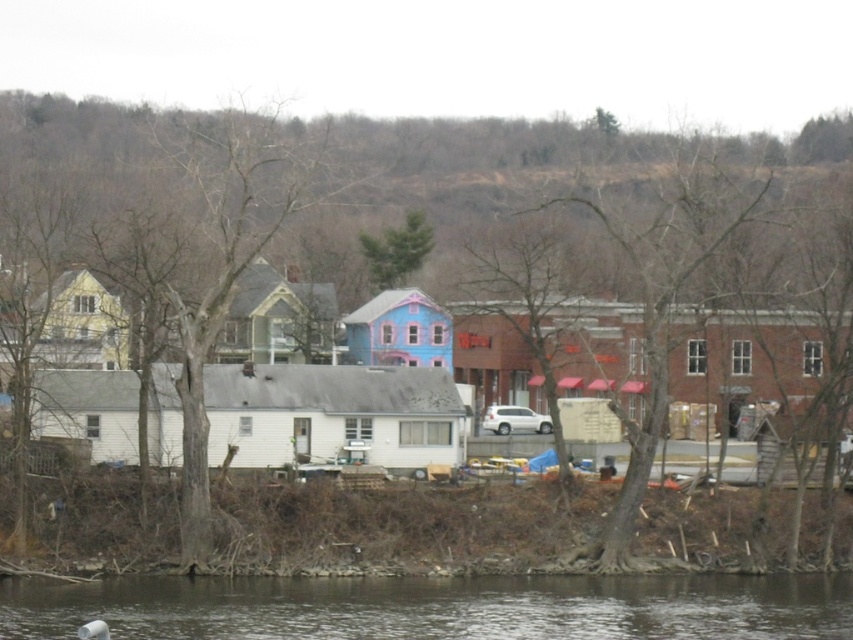
Which is more to the left, brown muddy water at lower center or bare branches at center?

brown muddy water at lower center

Is brown muddy water at lower center to the left of bare branches at center from the viewer's perspective?

Indeed, brown muddy water at lower center is positioned on the left side of bare branches at center.

Where is `brown muddy water at lower center`? Image resolution: width=853 pixels, height=640 pixels. brown muddy water at lower center is located at coordinates (436, 608).

Does point (42, 300) come behind point (363, 252)?

That is False.

Which is above, brown bark tree at left or green matte tree at upper center?

green matte tree at upper center is above.

Is point (9, 212) in front of point (363, 248)?

Yes.

You are a GUI agent. You are given a task and a screenshot of the screen. Output one action in this format:
    pyautogui.click(x=<x>, y=<y>)
    Task: Click on the brown bark tree at left
    The width and height of the screenshot is (853, 640).
    Given the screenshot: What is the action you would take?
    coord(28,296)

Measure the distance between point (273, 113) and camera.

The distance of point (273, 113) from camera is 112.82 meters.

Looking at this image, between bare wood tree at center and bare branches at center, which one appears on the left side from the viewer's perspective?

bare wood tree at center

Does point (234, 160) lie behind point (683, 157)?

That is False.

Locate an element on the screen. The image size is (853, 640). bare wood tree at center is located at coordinates [x=231, y=253].